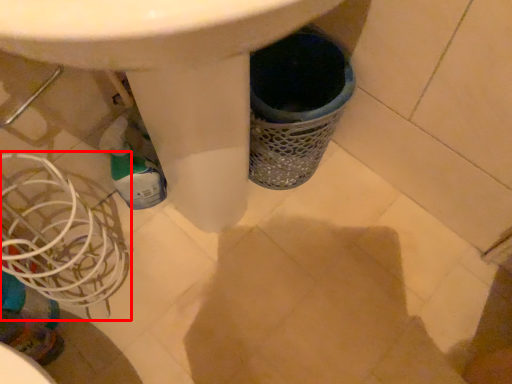
Question: From the image's perspective, considering the relative positions of basket (annotated by the red box) and bottle in the image provided, where is basket (annotated by the red box) located with respect to the staircase?

Choices:
 (A) below
 (B) above

Answer: (A)